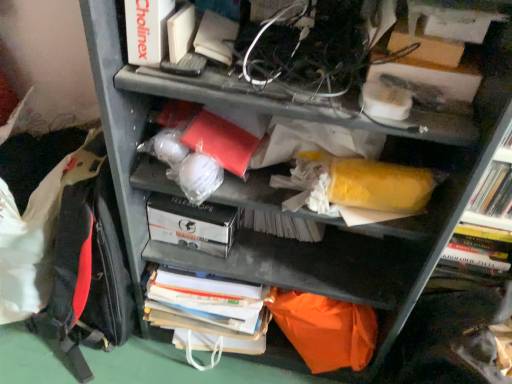
Question: From the image's perspective, is white matte book at upper left, which is counted as the 2th paperback book, starting from the back, on white cardboard box at center, arranged as the second paperback book when viewed from the top?

Choices:
 (A) no
 (B) yes

Answer: (B)

Question: Considering the relative positions of white matte book at upper left, the 1th paperback book in the front-to-back sequence, and white cardboard box at center, marked as the first paperback book in a bottom-to-top arrangement, in the image provided, is white matte book at upper left, the 1th paperback book in the front-to-back sequence, to the right of white cardboard box at center, marked as the first paperback book in a bottom-to-top arrangement, from the viewer's perspective?

Choices:
 (A) yes
 (B) no

Answer: (B)

Question: Is white cardboard box at center, the 2th paperback book in the front-to-back sequence, a part of white matte book at upper left, the 1th paperback book in the front-to-back sequence?

Choices:
 (A) no
 (B) yes

Answer: (A)

Question: Can we say white matte book at upper left, which is counted as the 2th paperback book, starting from the back, lies outside white cardboard box at center, acting as the first paperback book starting from the back?

Choices:
 (A) yes
 (B) no

Answer: (A)

Question: Is white matte book at upper left, which is the 1th paperback book from top to bottom, far from white cardboard box at center, marked as the first paperback book in a bottom-to-top arrangement?

Choices:
 (A) yes
 (B) no

Answer: (B)

Question: Considering the relative positions of white matte book at upper left, the 1th paperback book in the front-to-back sequence, and white cardboard box at center, acting as the first paperback book starting from the back, in the image provided, is white matte book at upper left, the 1th paperback book in the front-to-back sequence, to the left of white cardboard box at center, acting as the first paperback book starting from the back, from the viewer's perspective?

Choices:
 (A) yes
 (B) no

Answer: (A)

Question: Is yellow matte bookshelf at right thinner than white cardboard box at center, arranged as the second paperback book when viewed from the top?

Choices:
 (A) yes
 (B) no

Answer: (A)

Question: Is yellow matte bookshelf at right facing towards white cardboard box at center, acting as the first paperback book starting from the back?

Choices:
 (A) no
 (B) yes

Answer: (A)

Question: Considering the relative positions of yellow matte bookshelf at right and white cardboard box at center, the 2th paperback book in the front-to-back sequence, in the image provided, is yellow matte bookshelf at right in front of white cardboard box at center, the 2th paperback book in the front-to-back sequence,?

Choices:
 (A) yes
 (B) no

Answer: (A)

Question: Is white cardboard box at center, acting as the first paperback book starting from the back, located within yellow matte bookshelf at right?

Choices:
 (A) yes
 (B) no

Answer: (B)

Question: Is yellow matte bookshelf at right bigger than white cardboard box at center, marked as the first paperback book in a bottom-to-top arrangement?

Choices:
 (A) yes
 (B) no

Answer: (A)

Question: Is yellow matte bookshelf at right at the right side of white cardboard box at center, arranged as the second paperback book when viewed from the top?

Choices:
 (A) yes
 (B) no

Answer: (A)

Question: Does red fabric backpack at left have a greater width compared to yellow matte bookshelf at right?

Choices:
 (A) yes
 (B) no

Answer: (A)